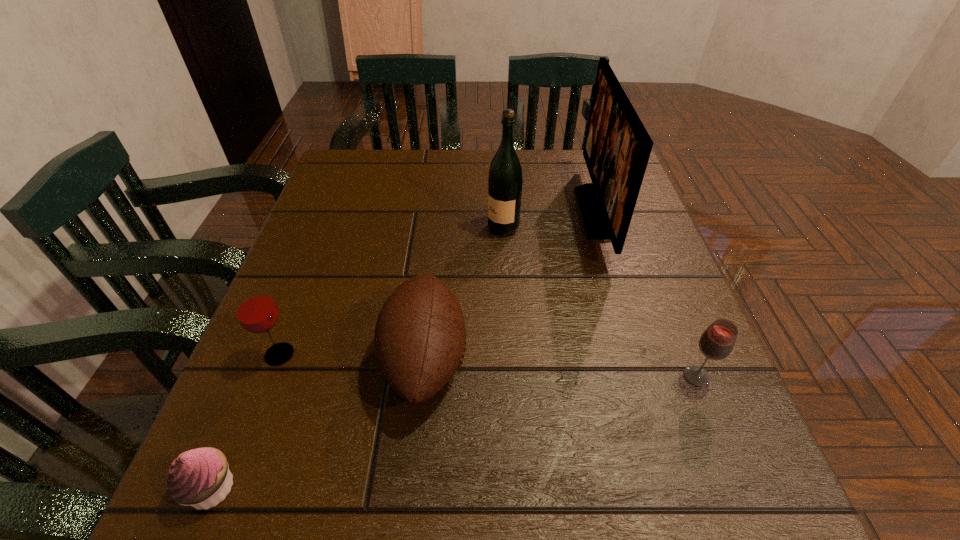
Where is `vacant space situated on the front-facing side of the monitor`? vacant space situated on the front-facing side of the monitor is located at coordinates (493, 212).

The image size is (960, 540). Identify the location of vacant space positioned on the front-facing side of the third object from right to left. (336, 228).

You are a GUI agent. You are given a task and a screenshot of the screen. Output one action in this format:
    pyautogui.click(x=<x>, y=<y>)
    Task: Click on the vacant area situated on the front-facing side of the third object from right to left
    Image resolution: width=960 pixels, height=540 pixels.
    Given the screenshot: What is the action you would take?
    pyautogui.click(x=371, y=228)

Locate an element on the screen. Image resolution: width=960 pixels, height=540 pixels. free space located on the front-facing side of the third object from right to left is located at coordinates (393, 228).

I want to click on free space located on the right of the taller glass drink container, so click(x=331, y=355).

The image size is (960, 540). What are the coordinates of `free space located on the laces of the football` in the screenshot? It's located at (663, 359).

Where is `free space located on the left of the right glass drink container`? The height and width of the screenshot is (540, 960). free space located on the left of the right glass drink container is located at coordinates (582, 376).

What are the coordinates of `free location located on the back of the cupcake` in the screenshot? It's located at (296, 284).

Identify the location of object that is at the far edge. Image resolution: width=960 pixels, height=540 pixels. (617, 147).

The height and width of the screenshot is (540, 960). What are the coordinates of `object positioned at the near edge` in the screenshot? It's located at (200, 477).